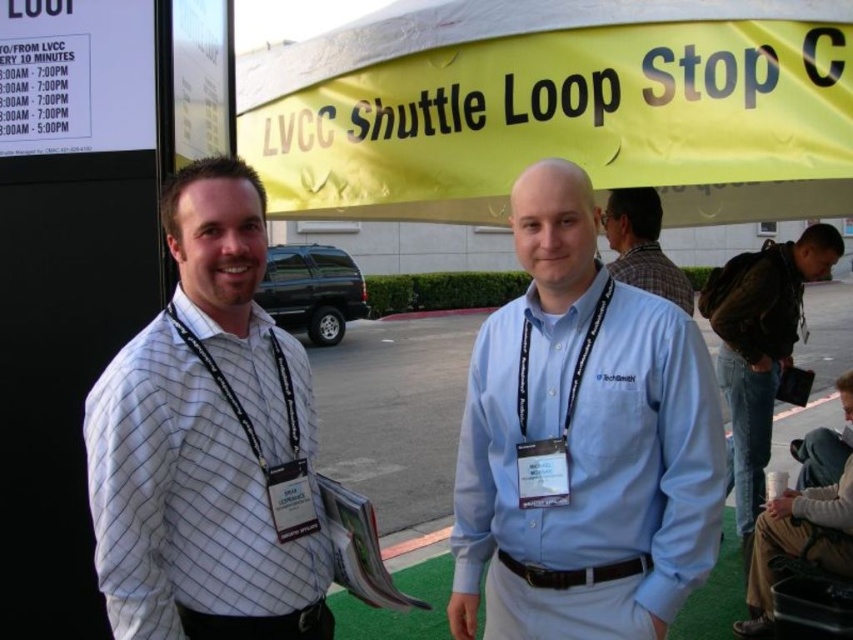
Measure the distance between light blue shirt at center and camera.

They are 5.92 feet apart.

Does point (561, 342) come farther from viewer compared to point (790, 445)?

No, (561, 342) is in front of (790, 445).

I want to click on light blue shirt at center, so click(584, 442).

Does black leather jacket at lower right appear over light brown leather jacket at lower right?

Yes.

Who is more forward, (x=828, y=232) or (x=762, y=509)?

Point (x=828, y=232) is more forward.

Does point (775, 275) come closer to viewer compared to point (846, 560)?

No, it is behind (846, 560).

This screenshot has height=640, width=853. In order to click on black leather jacket at lower right in this screenshot , I will do `click(759, 346)`.

Does light brown leather jacket at lower right have a greater width compared to plaid shirt at center?

Yes.

Is light brown leather jacket at lower right to the left of plaid shirt at center from the viewer's perspective?

Incorrect, light brown leather jacket at lower right is not on the left side of plaid shirt at center.

Who is more forward, (848, 481) or (685, 307)?

Point (848, 481)

The image size is (853, 640). Find the location of `light brown leather jacket at lower right`. light brown leather jacket at lower right is located at coordinates (798, 541).